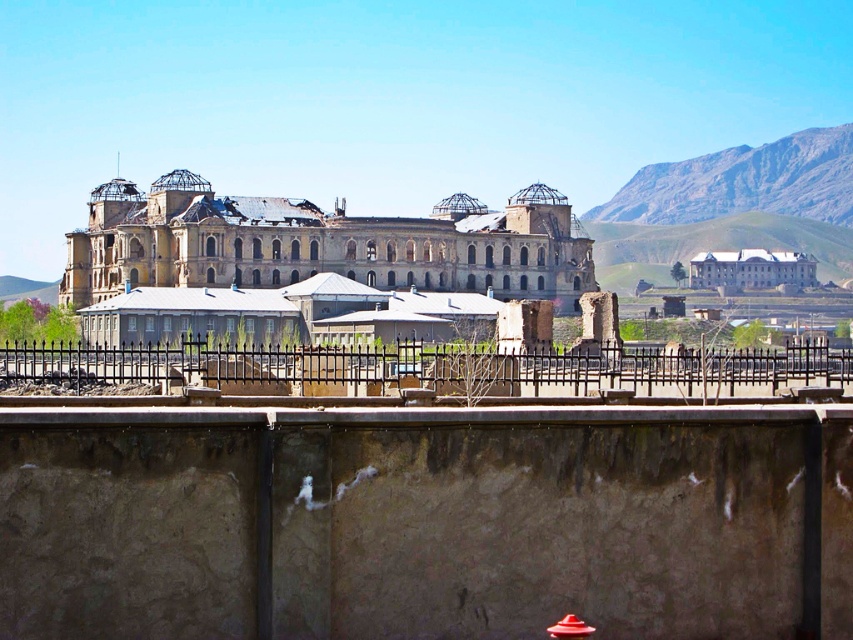
Question: Can you confirm if weathered stone palace at center is bigger than matte red fire hydrant at center?

Choices:
 (A) yes
 (B) no

Answer: (A)

Question: Does weathered stone palace at center appear on the right side of matte red fire hydrant at center?

Choices:
 (A) no
 (B) yes

Answer: (A)

Question: Which of the following is the farthest from the observer?

Choices:
 (A) (625, 372)
 (B) (550, 637)
 (C) (808, 273)

Answer: (C)

Question: Does weathered stone palace at center have a smaller size compared to black wrought iron fence at center?

Choices:
 (A) yes
 (B) no

Answer: (B)

Question: Which object is the farthest from the black wrought iron fence at center?

Choices:
 (A) matte red fire hydrant at center
 (B) white smooth building at center

Answer: (B)

Question: Which of the following is the closest to the observer?

Choices:
 (A) (390, 348)
 (B) (761, 275)
 (C) (555, 625)

Answer: (C)